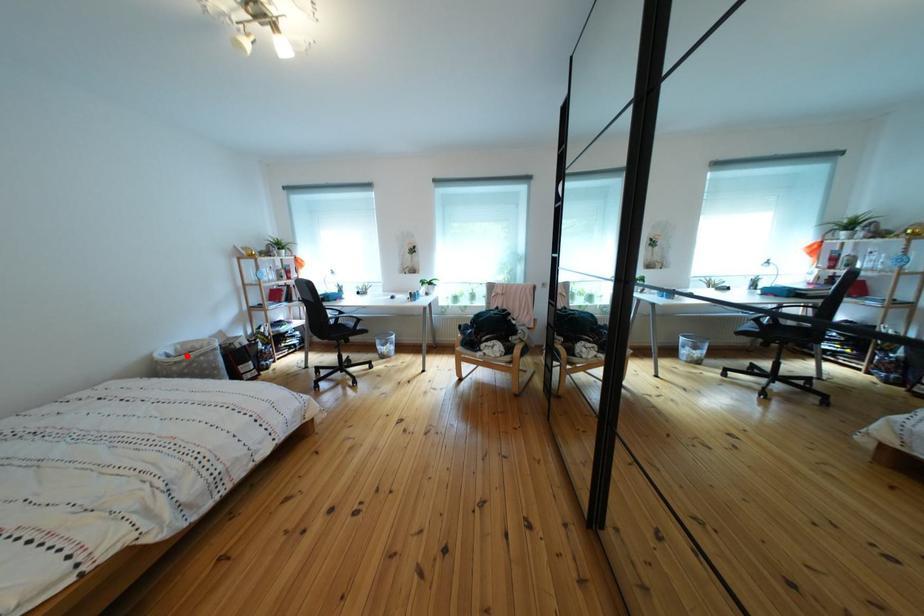
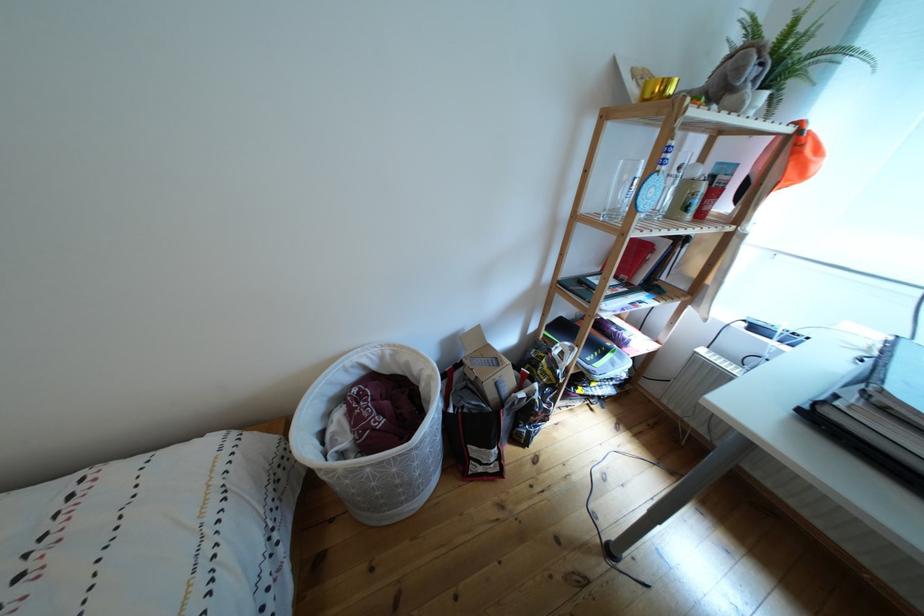
Where in the second image is the point corresponding to the highlighted location from the first image?

(393, 363)